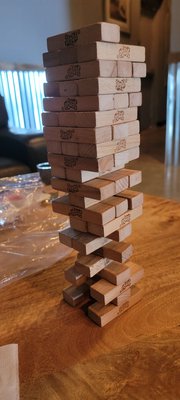
Where is `tabletop`? tabletop is located at coordinates (52, 336), (157, 312), (8, 294), (79, 382).